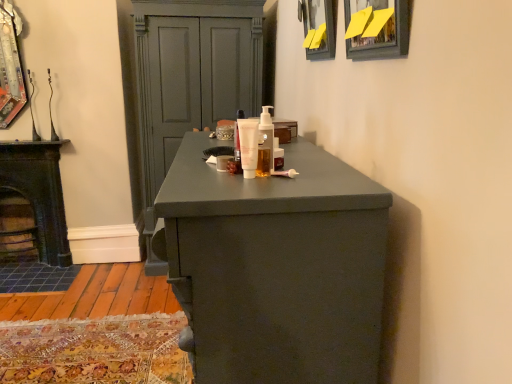
Find the location of a particular element. The height and width of the screenshot is (384, 512). free space in front of white matte tube at center is located at coordinates (238, 172).